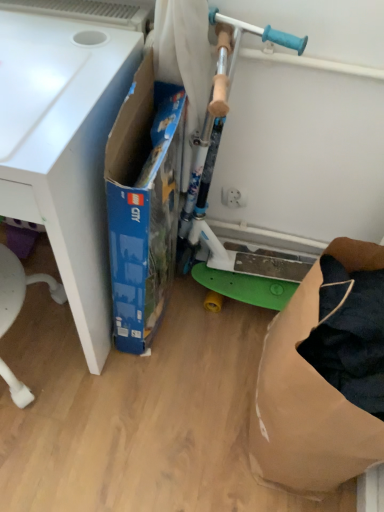
Question: Can you confirm if white matte desk at left is positioned to the right of green plastic scooter at center?

Choices:
 (A) yes
 (B) no

Answer: (B)

Question: From the image's perspective, is white matte desk at left over green plastic scooter at center?

Choices:
 (A) no
 (B) yes

Answer: (B)

Question: Can you confirm if white matte desk at left is taller than green plastic scooter at center?

Choices:
 (A) yes
 (B) no

Answer: (B)

Question: From a real-world perspective, is white matte desk at left under green plastic scooter at center?

Choices:
 (A) yes
 (B) no

Answer: (A)

Question: Is white matte desk at left far from green plastic scooter at center?

Choices:
 (A) no
 (B) yes

Answer: (A)

Question: Is green plastic scooter at center at the back of white matte desk at left?

Choices:
 (A) yes
 (B) no

Answer: (B)

Question: Would you say green plastic scooter at center is outside brown paper bag at lower right?

Choices:
 (A) yes
 (B) no

Answer: (A)

Question: Is green plastic scooter at center shorter than brown paper bag at lower right?

Choices:
 (A) yes
 (B) no

Answer: (B)

Question: Is green plastic scooter at center looking in the opposite direction of brown paper bag at lower right?

Choices:
 (A) no
 (B) yes

Answer: (A)

Question: Can you confirm if green plastic scooter at center is thinner than brown paper bag at lower right?

Choices:
 (A) yes
 (B) no

Answer: (A)

Question: Does green plastic scooter at center lie behind brown paper bag at lower right?

Choices:
 (A) no
 (B) yes

Answer: (B)

Question: Is green plastic scooter at center positioned far away from brown paper bag at lower right?

Choices:
 (A) yes
 (B) no

Answer: (B)

Question: Does blue cardboard box at center appear on the right side of green plastic scooter at center?

Choices:
 (A) yes
 (B) no

Answer: (B)